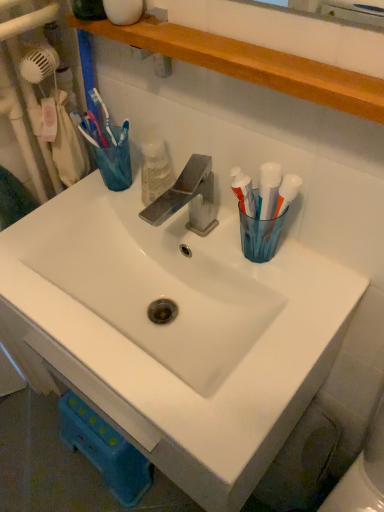
This screenshot has height=512, width=384. I want to click on free point above wooden shelf at upper center (from a real-world perspective), so click(220, 41).